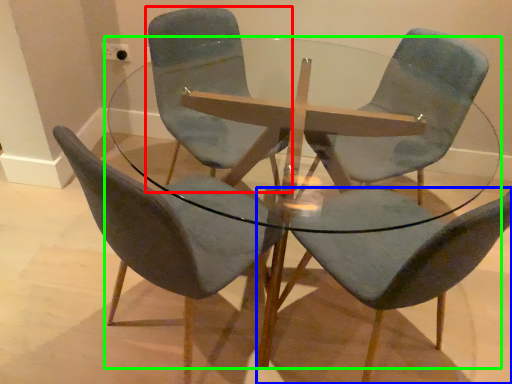
Question: Which object is positioned farthest from chair (highlighted by a red box)? Select from chair (highlighted by a blue box) and coffee table (highlighted by a green box).

Choices:
 (A) chair
 (B) coffee table

Answer: (A)